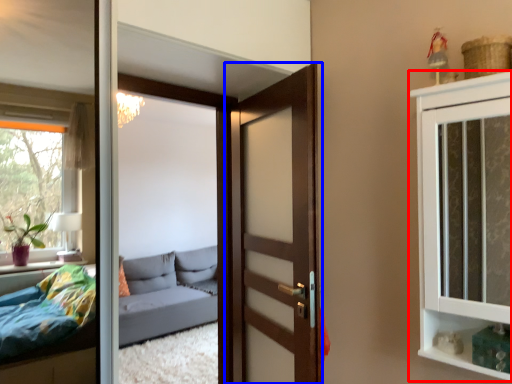
Question: Which object is closer to the camera taking this photo, cabinetry (highlighted by a red box) or door (highlighted by a blue box)?

Choices:
 (A) cabinetry
 (B) door

Answer: (A)